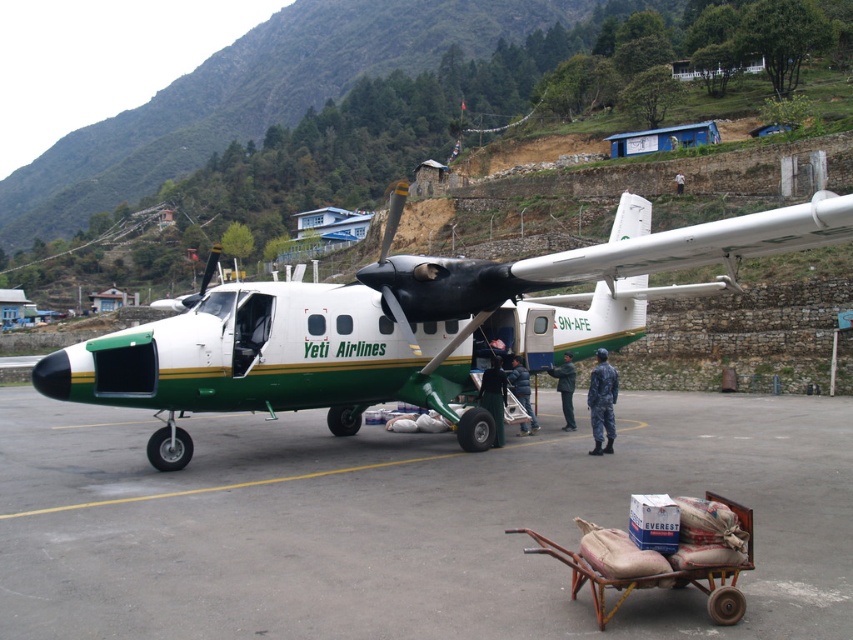
You are standing at the edge of the tarmac and want to reach the aircraft parked at the center. The smooth concrete tarmac at center is the path you need to cross. If your walking distance is limited to 4 meters before needing to rest, will you be able to reach the aircraft without resting?

The smooth concrete tarmac at center is 3.80 meters away from the viewer. Since your walking distance limit is 4 meters, you can reach the aircraft without needing to rest.

You are a pilot standing at the white fabric shirt at center. You need to board the white matte airplane at center. Can you walk directly to the airplane without any obstacles between you and the airplane?

The white matte airplane at center and white fabric shirt at center are 64.75 feet apart. There is no mention of obstacles in the scene description, so you can walk directly to the airplane.